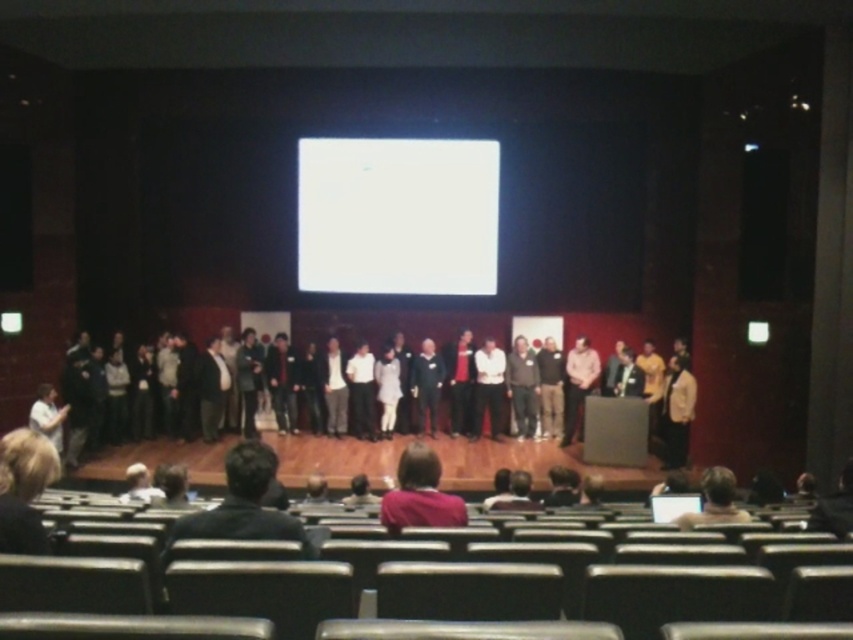
You are attending this event and want to take a photo of the dark gray sweater at center and the blonde hair at lower left. Which one will appear larger in your photo?

The dark gray sweater at center will appear larger in your photo because it is bigger than the blonde hair at lower left.